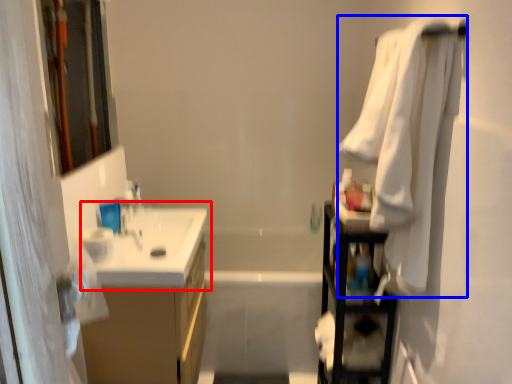
Question: Which object appears farthest to the camera in this image, sink (highlighted by a red box) or bath towel (highlighted by a blue box)?

Choices:
 (A) sink
 (B) bath towel

Answer: (A)